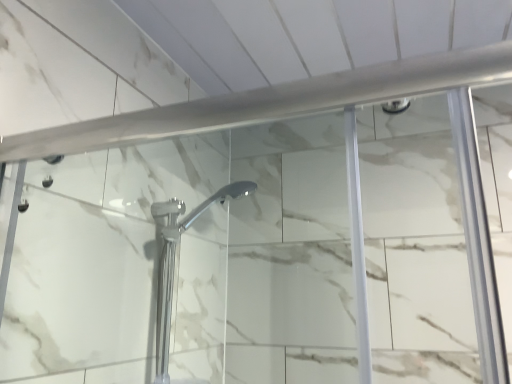
This screenshot has width=512, height=384. What do you see at coordinates (176, 260) in the screenshot?
I see `polished chrome shower head at center` at bounding box center [176, 260].

Where is `polished chrome shower head at center`? polished chrome shower head at center is located at coordinates (176, 260).

The width and height of the screenshot is (512, 384). Identify the location of polished chrome shower head at center. (176, 260).